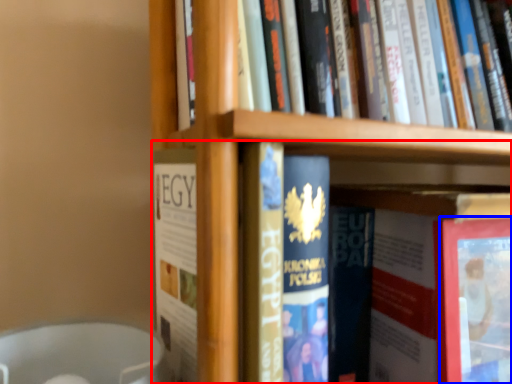
Question: Among these objects, which one is nearest to the camera, book (highlighted by a red box) or paperback book (highlighted by a blue box)?

Choices:
 (A) book
 (B) paperback book

Answer: (A)